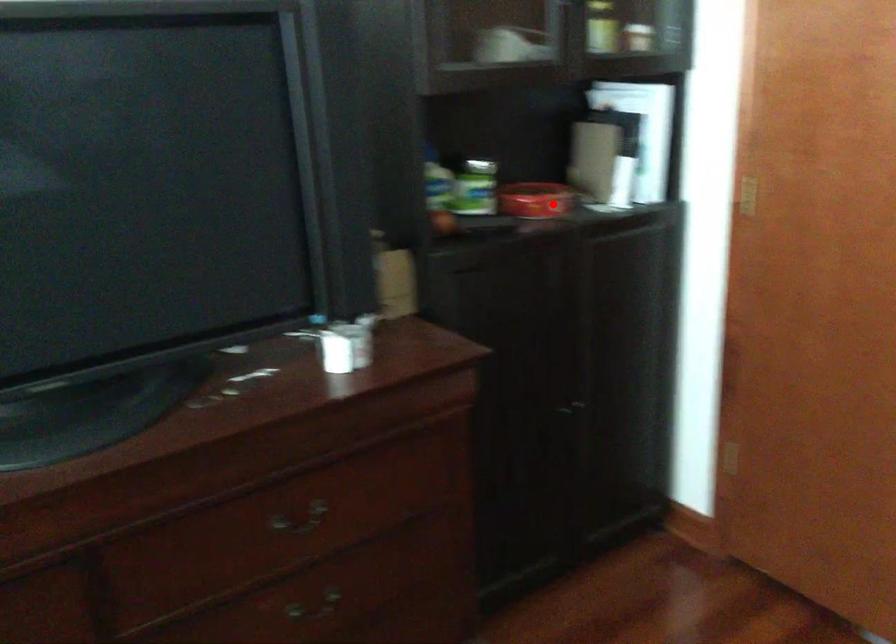
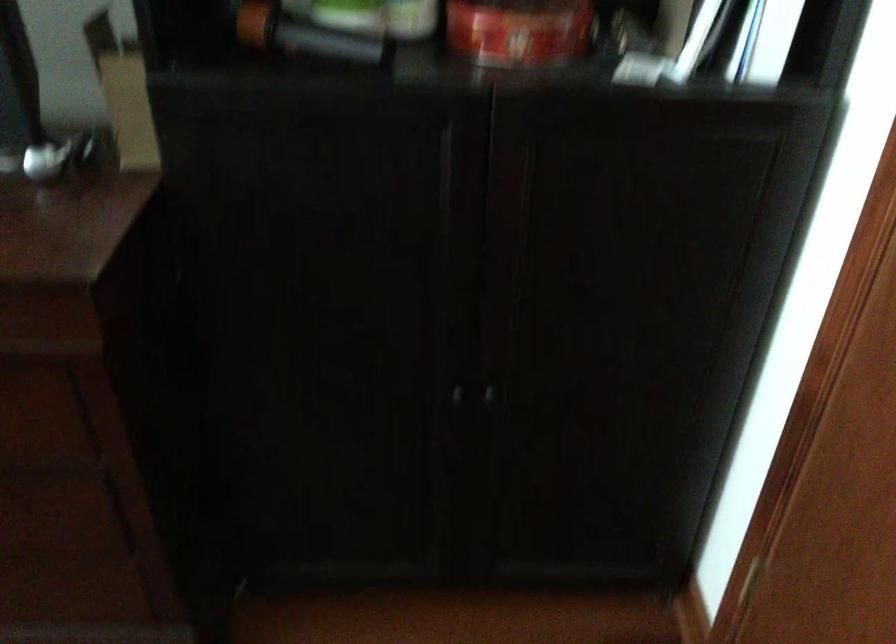
In the second image, find the point that corresponds to the highlighted location in the first image.

(519, 31)